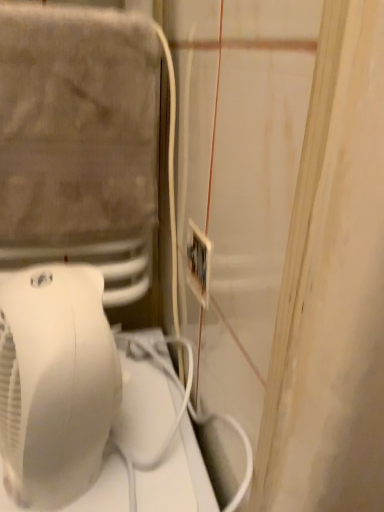
Question: Should I look upward or downward to see white plastic fan at left?

Choices:
 (A) up
 (B) down

Answer: (B)

Question: Considering the relative sizes of white plastic electric outlet at center and white plastic fan at left in the image provided, is white plastic electric outlet at center taller than white plastic fan at left?

Choices:
 (A) yes
 (B) no

Answer: (B)

Question: Is white plastic electric outlet at center in contact with white plastic fan at left?

Choices:
 (A) yes
 (B) no

Answer: (B)

Question: Considering the relative sizes of white plastic electric outlet at center and white plastic fan at left in the image provided, is white plastic electric outlet at center smaller than white plastic fan at left?

Choices:
 (A) yes
 (B) no

Answer: (A)

Question: Is white plastic electric outlet at center further to camera compared to white plastic fan at left?

Choices:
 (A) yes
 (B) no

Answer: (A)

Question: Does white plastic electric outlet at center have a lesser height compared to white plastic fan at left?

Choices:
 (A) yes
 (B) no

Answer: (A)

Question: Can you confirm if white plastic electric outlet at center is bigger than white plastic fan at left?

Choices:
 (A) yes
 (B) no

Answer: (B)

Question: Can we say white plastic fan at left lies outside white plastic electric outlet at center?

Choices:
 (A) yes
 (B) no

Answer: (A)

Question: Considering the relative sizes of white plastic fan at left and white plastic electric outlet at center in the image provided, is white plastic fan at left taller than white plastic electric outlet at center?

Choices:
 (A) no
 (B) yes

Answer: (B)

Question: Is white plastic fan at left further to camera compared to white plastic electric outlet at center?

Choices:
 (A) no
 (B) yes

Answer: (A)

Question: Can you confirm if white plastic fan at left is smaller than white plastic electric outlet at center?

Choices:
 (A) no
 (B) yes

Answer: (A)

Question: Is white plastic fan at left wider than white plastic electric outlet at center?

Choices:
 (A) no
 (B) yes

Answer: (B)

Question: Does white plastic fan at left have a larger size compared to white plastic electric outlet at center?

Choices:
 (A) no
 (B) yes

Answer: (B)

Question: From a real-world perspective, is white plastic electric outlet at center above or below white plastic fan at left?

Choices:
 (A) above
 (B) below

Answer: (A)